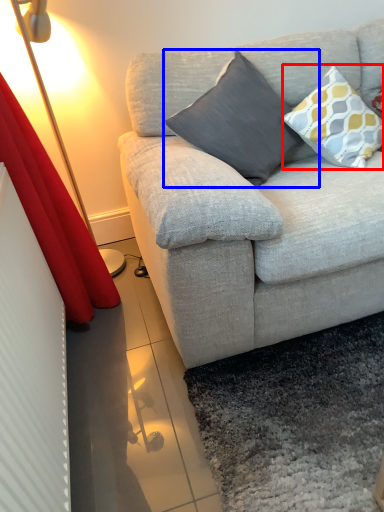
Question: Which point is closer to the camera, pillow (highlighted by a red box) or pillow (highlighted by a blue box)?

Choices:
 (A) pillow
 (B) pillow

Answer: (B)